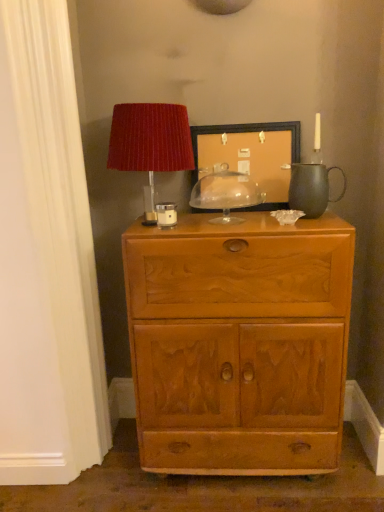
This screenshot has width=384, height=512. What are the coordinates of `vacant area on top of wooden picture frame at center (from a real-world perspective)` in the screenshot? It's located at (249, 121).